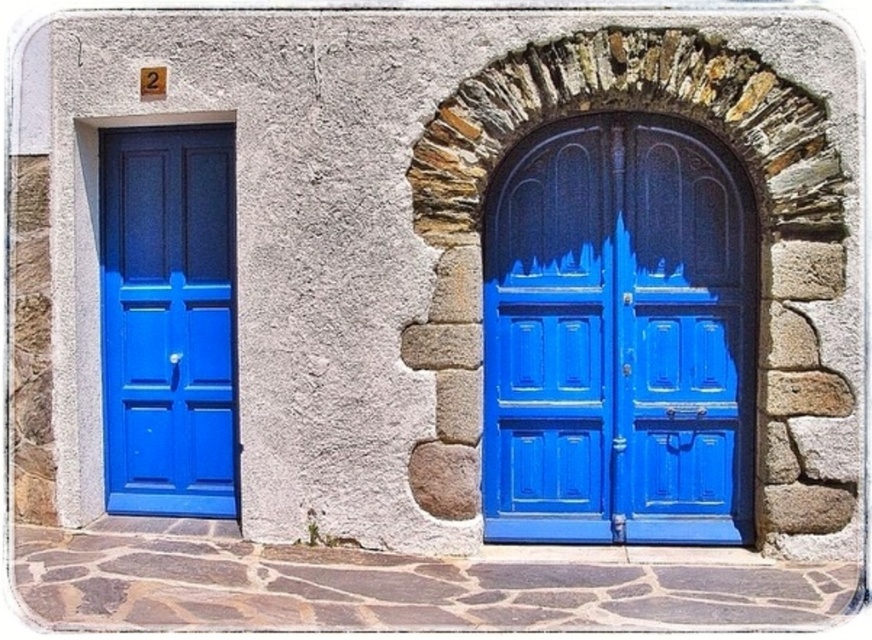
You are a painter who needs to decide which door to paint first. The matte blue door at center and the matte blue door at left are both blue. Which door should you paint first if you want to start with the taller one?

The matte blue door at center is much taller than the matte blue door at left, so you should paint the matte blue door at center first.